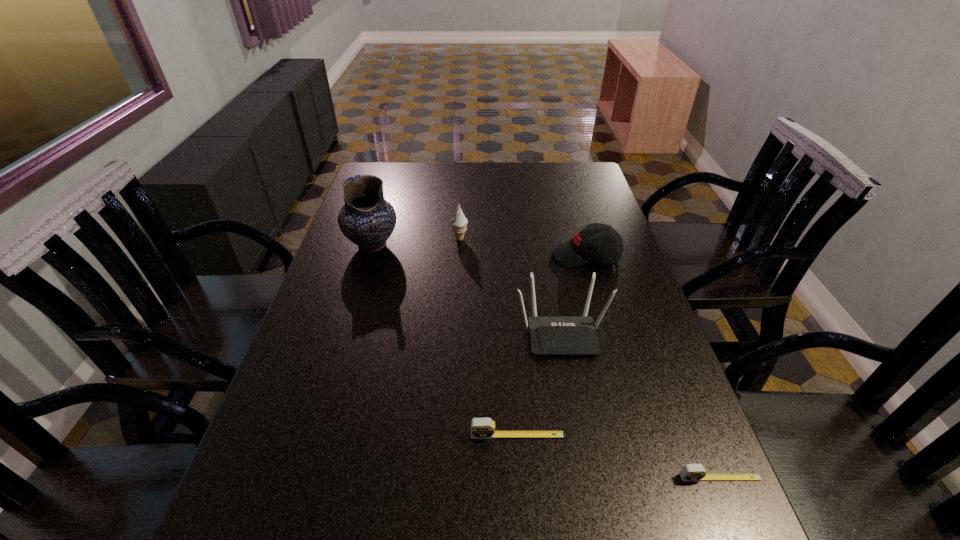
You are a GUI agent. You are given a task and a screenshot of the screen. Output one action in this format:
    pyautogui.click(x=<x>, y=<y>)
    Task: Click on the vacant space in between the taller tape measure and the fourth farthest object
    Image resolution: width=960 pixels, height=540 pixels.
    Given the screenshot: What is the action you would take?
    coord(540,384)

Locate an element on the screen. The width and height of the screenshot is (960, 540). blank region between the right tape measure and the second shortest object is located at coordinates (618, 456).

Where is `vacant area that lies between the pottery and the taller tape measure`? vacant area that lies between the pottery and the taller tape measure is located at coordinates (444, 340).

This screenshot has width=960, height=540. Find the location of `free space between the baseball cap and the nearer tape measure`. free space between the baseball cap and the nearer tape measure is located at coordinates (653, 367).

This screenshot has width=960, height=540. What are the coordinates of `free spot between the pottery and the baseball cap` in the screenshot? It's located at (479, 251).

Where is `free area in between the router and the leftmost object`? The width and height of the screenshot is (960, 540). free area in between the router and the leftmost object is located at coordinates (467, 289).

This screenshot has height=540, width=960. What are the coordinates of `empty location between the tallest object and the icecream` in the screenshot? It's located at (416, 242).

Find the location of a particular element. Image resolution: width=960 pixels, height=540 pixels. object that can be found as the second closest to the pottery is located at coordinates (548, 335).

Identify which object is the fifth closest to the icecream. Please provide its 2D coordinates. Your answer should be formatted as a tuple, i.e. [(x, y)], where the tuple contains the x and y coordinates of a point satisfying the conditions above.

[(690, 472)]